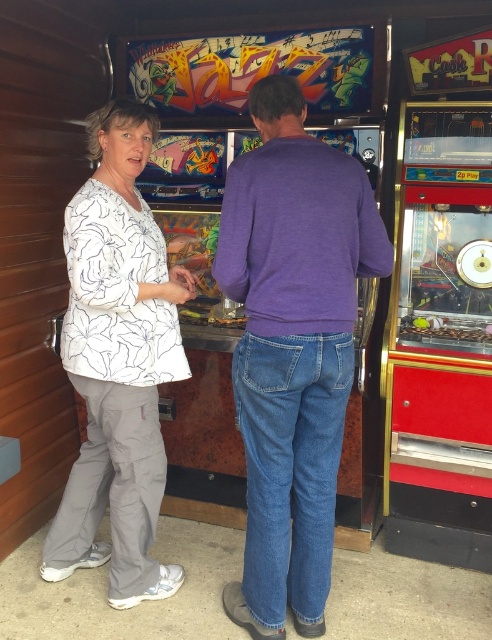
Question: Which point is farther to the camera?

Choices:
 (A) (153, 516)
 (B) (324, 522)

Answer: (A)

Question: Considering the relative positions of purple cotton sweater at center and white printed shirt at left in the image provided, where is purple cotton sweater at center located with respect to white printed shirt at left?

Choices:
 (A) right
 (B) left

Answer: (A)

Question: Can you confirm if purple cotton sweater at center is positioned to the left of white printed shirt at left?

Choices:
 (A) no
 (B) yes

Answer: (A)

Question: Which point appears closest to the camera in this image?

Choices:
 (A) (89, 387)
 (B) (305, 477)

Answer: (B)

Question: Does purple cotton sweater at center appear over white printed shirt at left?

Choices:
 (A) yes
 (B) no

Answer: (B)